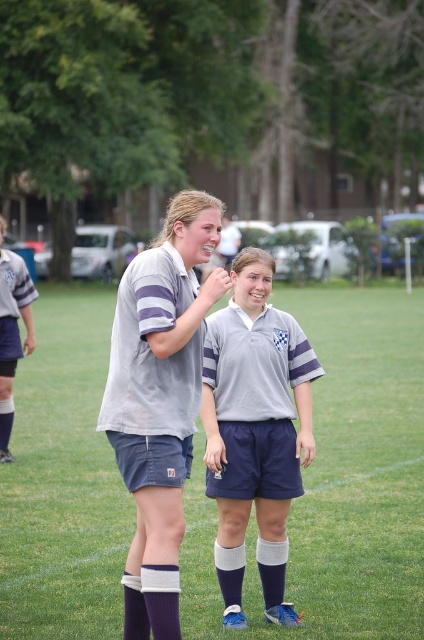
Between white fabric shorts at center and matte gray shorts at left, which one has less height?

matte gray shorts at left is shorter.

How much distance is there between white fabric shorts at center and matte gray shorts at left?

The distance of white fabric shorts at center from matte gray shorts at left is 5.96 meters.

The width and height of the screenshot is (424, 640). Find the location of `white fabric shorts at center`. white fabric shorts at center is located at coordinates (337, 483).

Is matte gray shirt at center shorter than matte gray shorts at left?

No, matte gray shirt at center is not shorter than matte gray shorts at left.

Who is more distant from viewer, [122,580] or [28,332]?

The point [28,332] is behind.

Is point (181, 397) positioned behind point (19, 353)?

No, (181, 397) is in front of (19, 353).

Where is `matte gray shirt at center`? This screenshot has height=640, width=424. matte gray shirt at center is located at coordinates (159, 400).

Looking at this image, which is above, matte gray uniform at center or white knit sock at lower center?

matte gray uniform at center is higher up.

Based on the photo, between matte gray uniform at center and white knit sock at lower center, which one is positioned lower?

white knit sock at lower center is lower down.

What do you see at coordinates (254, 429) in the screenshot? I see `matte gray uniform at center` at bounding box center [254, 429].

Locate an element on the screen. The image size is (424, 640). matte gray uniform at center is located at coordinates (254, 429).